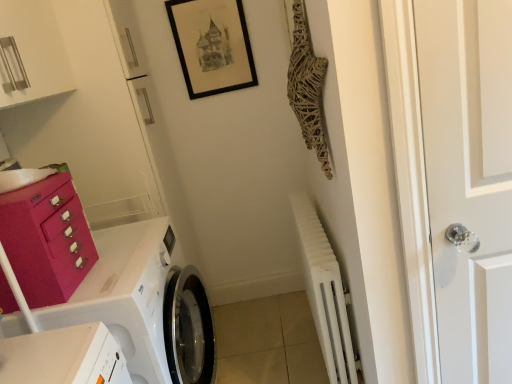
Question: In terms of height, does white glass door handle at right look taller or shorter compared to matte pink drawer at left?

Choices:
 (A) short
 (B) tall

Answer: (B)

Question: From the image's perspective, is white glass door handle at right located above or below matte pink drawer at left?

Choices:
 (A) below
 (B) above

Answer: (B)

Question: Estimate the real-world distances between objects in this image. Which object is farther from the white matte radiator at lower right?

Choices:
 (A) black matte picture frame at upper center
 (B) white glass door handle at right
 (C) white glossy washing machine at lower left
 (D) matte pink drawer at left

Answer: (A)

Question: Which object is the closest to the matte pink drawer at left?

Choices:
 (A) white glass door handle at right
 (B) white glossy washing machine at lower left
 (C) black matte picture frame at upper center
 (D) white matte radiator at lower right

Answer: (B)